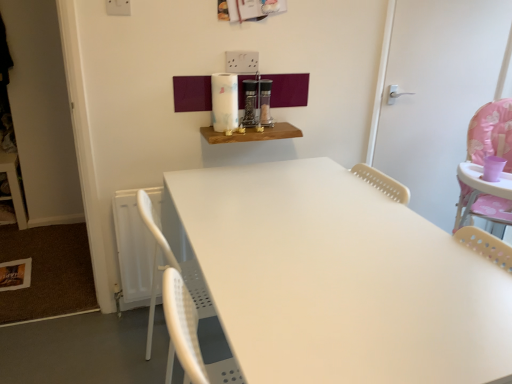
Question: From their relative heights in the image, would you say wooden shelf at upper center is taller or shorter than white plastic door at right?

Choices:
 (A) short
 (B) tall

Answer: (A)

Question: Looking at the image, does wooden shelf at upper center seem bigger or smaller compared to white plastic door at right?

Choices:
 (A) small
 (B) big

Answer: (A)

Question: Which is correct: wooden shelf at upper center is inside white plastic door at right, or outside of it?

Choices:
 (A) outside
 (B) inside

Answer: (A)

Question: Is white plastic door at right taller or shorter than wooden shelf at upper center?

Choices:
 (A) tall
 (B) short

Answer: (A)

Question: In the image, is white plastic door at right on the left side or the right side of wooden shelf at upper center?

Choices:
 (A) right
 (B) left

Answer: (A)

Question: From the image's perspective, is white plastic door at right positioned above or below wooden shelf at upper center?

Choices:
 (A) below
 (B) above

Answer: (B)

Question: Is point (501, 21) closer or farther from the camera than point (274, 130)?

Choices:
 (A) farther
 (B) closer

Answer: (A)